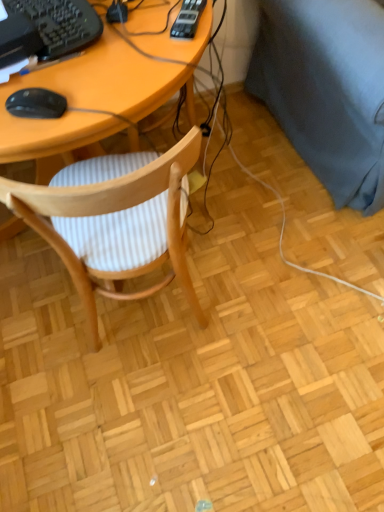
Image resolution: width=384 pixels, height=512 pixels. Identify the location of free space in front of wooden chair with striped cushion at center. (152, 417).